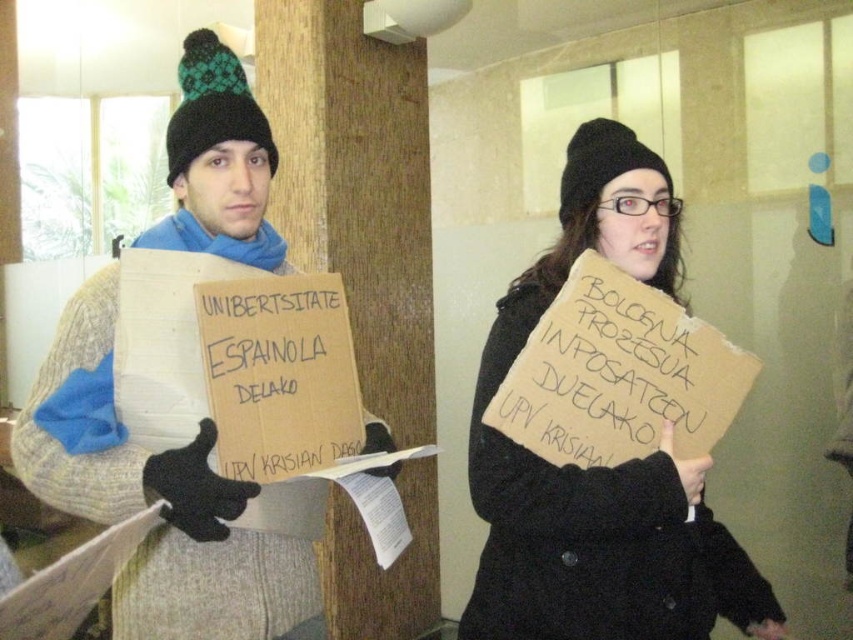
Which is behind, point (596, 476) or point (61, 396)?

Positioned behind is point (596, 476).

Is point (543, 464) positioned after point (148, 461)?

That is True.

This screenshot has width=853, height=640. Identify the location of matte cardboard sign at center. (599, 467).